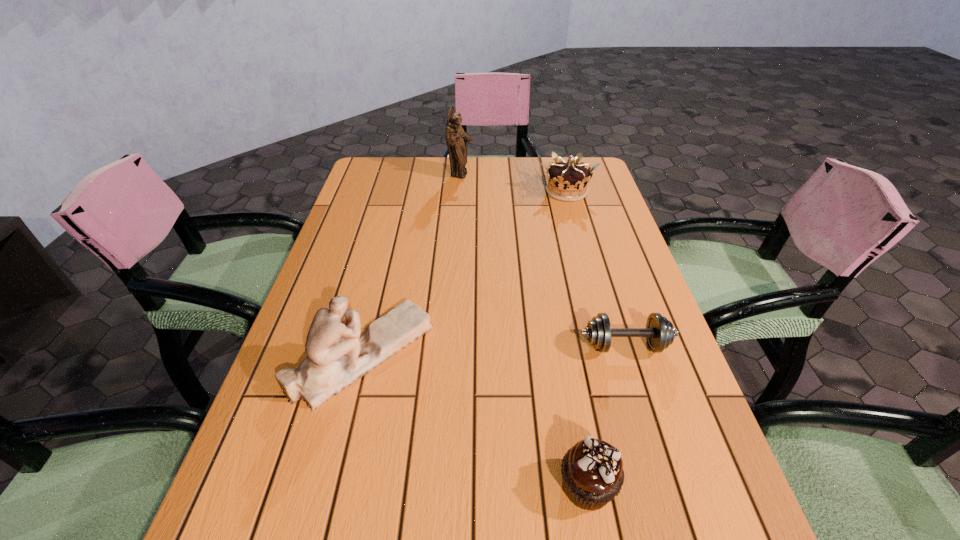
Find the location of a particular element. vacant space positioned on the front of the third tallest object is located at coordinates (579, 236).

Identify the location of vacant region located 0.360m on the back of the fourth tallest object. (556, 307).

Identify the location of vacant area situated on the back of the dumbbell. The image size is (960, 540). (594, 247).

Where is `figurine that is positioned at the far edge`? figurine that is positioned at the far edge is located at coordinates (456, 138).

At what (x,y) coordinates should I click in order to perform the action: click on crown located in the far edge section of the desktop. Please return your answer as a coordinate pair (x, y). Image resolution: width=960 pixels, height=540 pixels. Looking at the image, I should click on (567, 181).

Image resolution: width=960 pixels, height=540 pixels. Find the location of `object that is at the left edge`. object that is at the left edge is located at coordinates (337, 355).

Find the location of a particular element. The image size is (960, 540). crown that is at the right edge is located at coordinates (567, 181).

This screenshot has height=540, width=960. I want to click on dumbbell at the right edge, so click(x=659, y=332).

Identify the location of object located in the far right corner section of the desktop. (567, 181).

Image resolution: width=960 pixels, height=540 pixels. In order to click on vacant region at the left edge in this screenshot , I will do click(x=256, y=427).